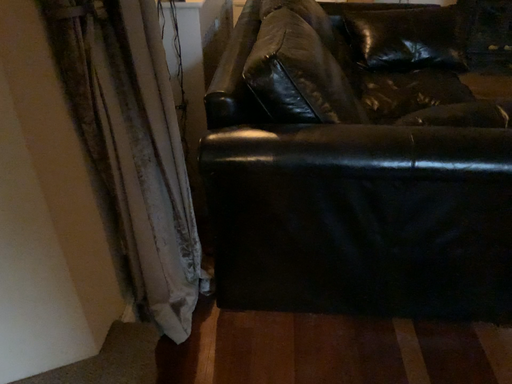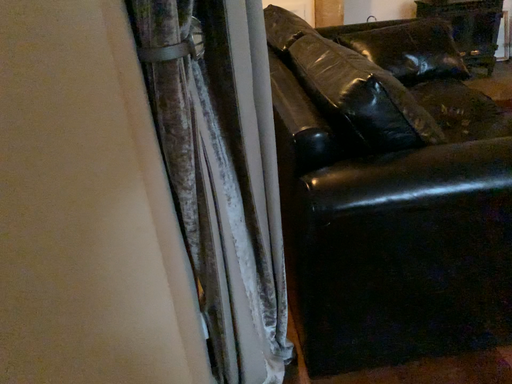
Question: How did the camera likely rotate when shooting the video?

Choices:
 (A) rotated right
 (B) rotated left

Answer: (A)